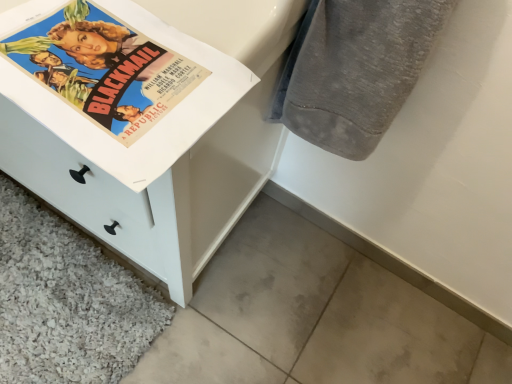
Question: Visually, is gray cotton towel at upper right positioned to the left or to the right of white matte chest of drawers at left?

Choices:
 (A) right
 (B) left

Answer: (A)

Question: From a real-world perspective, relative to white matte chest of drawers at left, is gray cotton towel at upper right vertically above or below?

Choices:
 (A) above
 (B) below

Answer: (A)

Question: From the image's perspective, relative to white matte chest of drawers at left, is gray cotton towel at upper right above or below?

Choices:
 (A) above
 (B) below

Answer: (B)

Question: Is white matte chest of drawers at left inside or outside of gray cotton towel at upper right?

Choices:
 (A) inside
 (B) outside

Answer: (B)

Question: From a real-world perspective, is white matte chest of drawers at left positioned above or below gray cotton towel at upper right?

Choices:
 (A) above
 (B) below

Answer: (B)

Question: Is white matte chest of drawers at left bigger or smaller than gray cotton towel at upper right?

Choices:
 (A) small
 (B) big

Answer: (B)

Question: In terms of width, does white matte chest of drawers at left look wider or thinner when compared to gray cotton towel at upper right?

Choices:
 (A) thin
 (B) wide

Answer: (B)